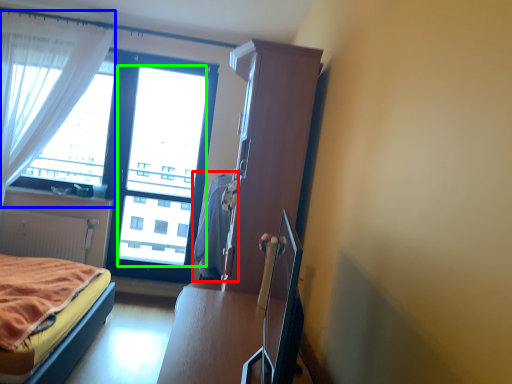
Question: Considering the real-world distances, which object is closest to blanket (highlighted by a red box)? curtain (highlighted by a blue box) or window screen (highlighted by a green box).

Choices:
 (A) curtain
 (B) window screen

Answer: (B)